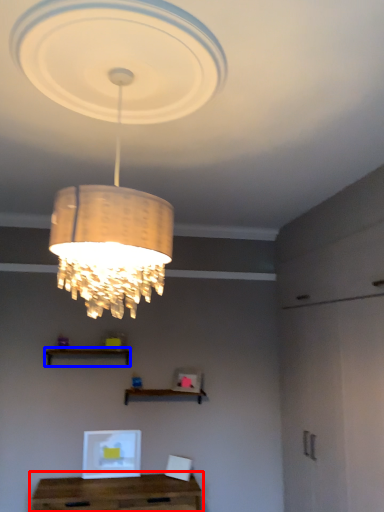
Question: Among these objects, which one is farthest to the camera, table (highlighted by a red box) or shelf (highlighted by a blue box)?

Choices:
 (A) table
 (B) shelf

Answer: (B)